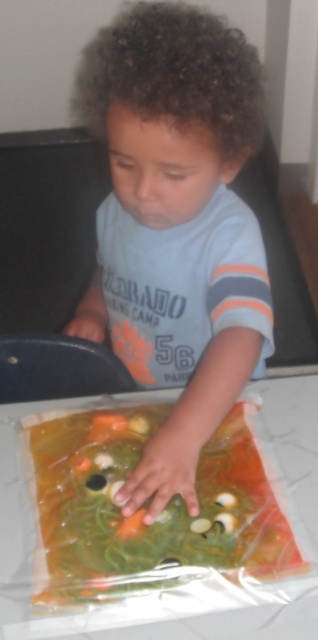
Can you confirm if matte blue shirt at center is positioned to the right of translucent plastic bag at center?

Correct, you'll find matte blue shirt at center to the right of translucent plastic bag at center.

At what (x,y) coordinates should I click in order to perform the action: click on matte blue shirt at center. Please return your answer as a coordinate pair (x, y). The height and width of the screenshot is (640, 318). Looking at the image, I should click on (178, 228).

Where is `matte blue shirt at center`? matte blue shirt at center is located at coordinates (178, 228).